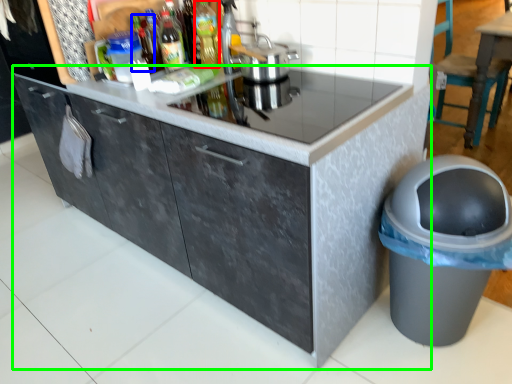
Question: Based on their relative distances, which object is nearer to bottle (highlighted by a red box)? Choose from bottle (highlighted by a blue box) and cabinetry (highlighted by a green box).

Choices:
 (A) bottle
 (B) cabinetry

Answer: (A)